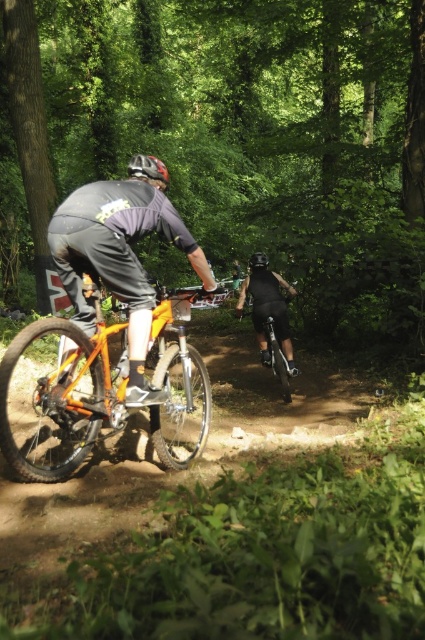
Who is higher up, shiny black bicycle at center or matte black helmet at center?

Positioned higher is matte black helmet at center.

Does point (244, 282) come in front of point (139, 172)?

That is False.

At what (x,y) coordinates should I click in order to perform the action: click on shiny black bicycle at center. Please return your answer as a coordinate pair (x, y). The height and width of the screenshot is (640, 425). Looking at the image, I should click on (277, 358).

Can you confirm if orange matte dirt bike at left is positioned below matte black helmet at center?

Indeed, orange matte dirt bike at left is positioned under matte black helmet at center.

Is orange matte dirt bike at left to the right of matte black helmet at center from the viewer's perspective?

Result: Yes, orange matte dirt bike at left is to the right of matte black helmet at center.

Locate an element on the screen. The width and height of the screenshot is (425, 640). orange matte dirt bike at left is located at coordinates (62, 397).

In order to click on orange matte dirt bike at left in this screenshot , I will do `click(62, 397)`.

Does matte black helmet at center have a greater width compared to black matte bicycle helmet at center?

Yes, matte black helmet at center is wider than black matte bicycle helmet at center.

Is matte black helmet at center to the left of black matte bicycle helmet at center from the viewer's perspective?

Indeed, matte black helmet at center is positioned on the left side of black matte bicycle helmet at center.

Does point (144, 156) come closer to viewer compared to point (257, 259)?

Yes.

Image resolution: width=425 pixels, height=640 pixels. Identify the location of matte black helmet at center. (147, 168).